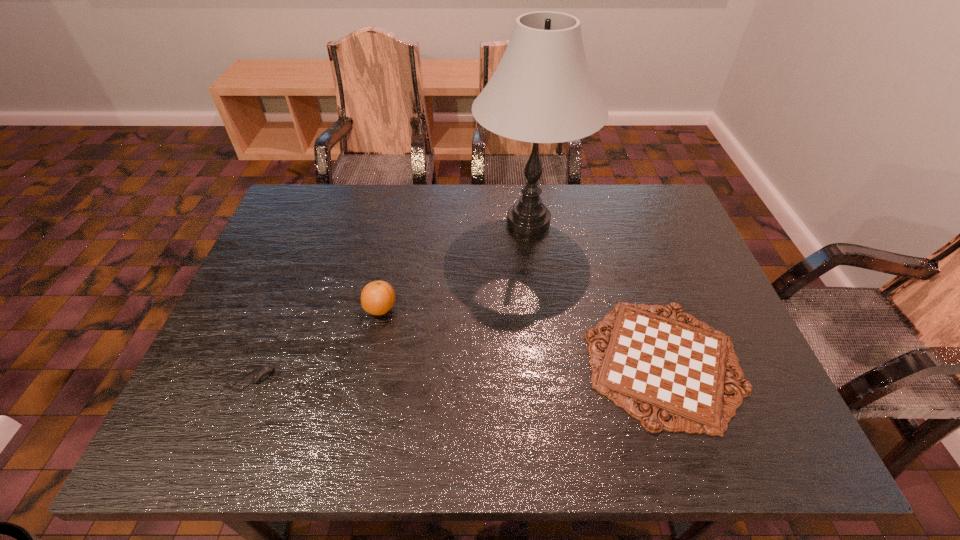
Where is `object positioned at the far edge`? The image size is (960, 540). object positioned at the far edge is located at coordinates (542, 91).

At what (x,y) coordinates should I click in order to perform the action: click on object that is at the near edge. Please return your answer as a coordinate pair (x, y). Looking at the image, I should click on (671, 368).

The image size is (960, 540). Identify the location of object that is at the left edge. (263, 373).

I want to click on object that is at the right edge, so click(x=671, y=368).

At what (x,y) coordinates should I click in order to perform the action: click on object that is at the near right corner. Please return your answer as a coordinate pair (x, y). The width and height of the screenshot is (960, 540). Looking at the image, I should click on (671, 368).

This screenshot has width=960, height=540. In order to click on vacant region at the far edge of the desktop in this screenshot , I will do `click(456, 201)`.

What are the coordinates of `free space at the left edge of the desktop` in the screenshot? It's located at pyautogui.click(x=213, y=410).

Find the location of a particular element. vacant region at the right edge of the desktop is located at coordinates (753, 409).

I want to click on vacant point at the far left corner, so click(331, 212).

The image size is (960, 540). What are the coordinates of `free space at the near left corner of the desktop` in the screenshot? It's located at (192, 442).